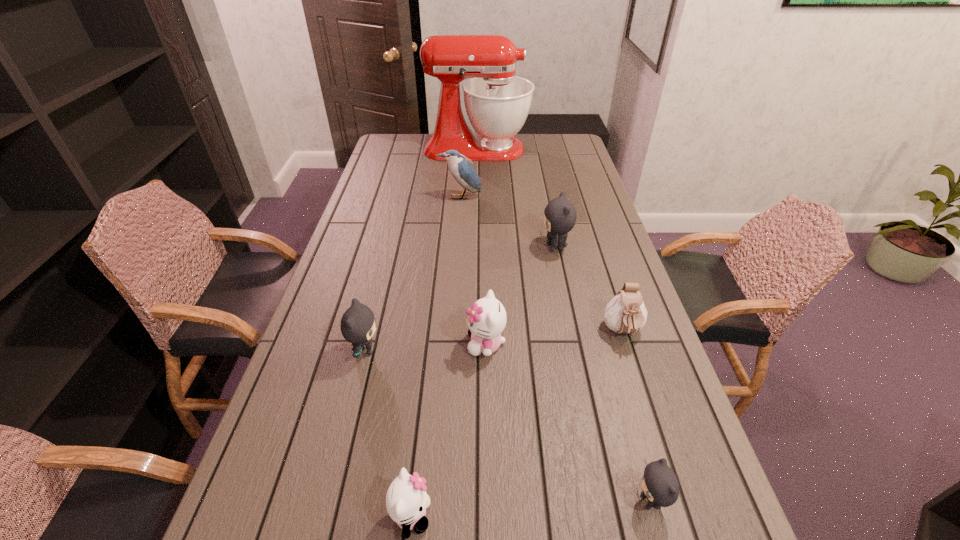
Find the location of a particular element. This screenshot has width=960, height=540. vacant area at the right edge of the desktop is located at coordinates (608, 358).

Where is `vacant region at the far left corner of the desktop`? The image size is (960, 540). vacant region at the far left corner of the desktop is located at coordinates (390, 144).

In the image, there is a desktop. Find the location of `vacant space at the far right corner`. vacant space at the far right corner is located at coordinates (577, 152).

The image size is (960, 540). I want to click on vacant space that is in between the farthest gray kitten and the bigger white kitten, so click(x=520, y=295).

Where is `vacant space that is in between the bird and the nearest gray kitten`? vacant space that is in between the bird and the nearest gray kitten is located at coordinates (555, 349).

Locate an element on the screen. free space between the pouch and the farthest kitten is located at coordinates (589, 290).

Where is `free spot between the pouch and the bigger white kitten`? The height and width of the screenshot is (540, 960). free spot between the pouch and the bigger white kitten is located at coordinates (554, 338).

This screenshot has width=960, height=540. Identify the location of object that is the closest to the left white kitten. (357, 325).

Identify which object is the third nearest to the farthest object. Please provide its 2D coordinates. Your answer should be formatted as a tuple, i.e. [(x, y)], where the tuple contains the x and y coordinates of a point satisfying the conditions above.

[(626, 313)]

Identify the location of kitten that is the closest to the second farthest object. (560, 215).